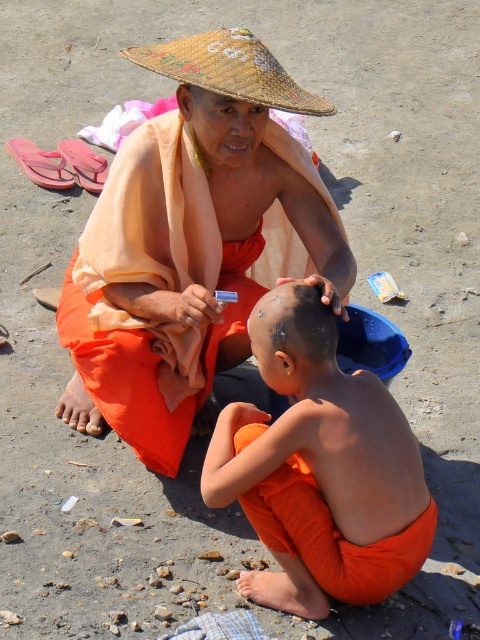
You are a photographer trying to capture the orange cloth monk at center. What are the coordinates where you should focus your camera?

The orange cloth monk at center is located at point (193,243).